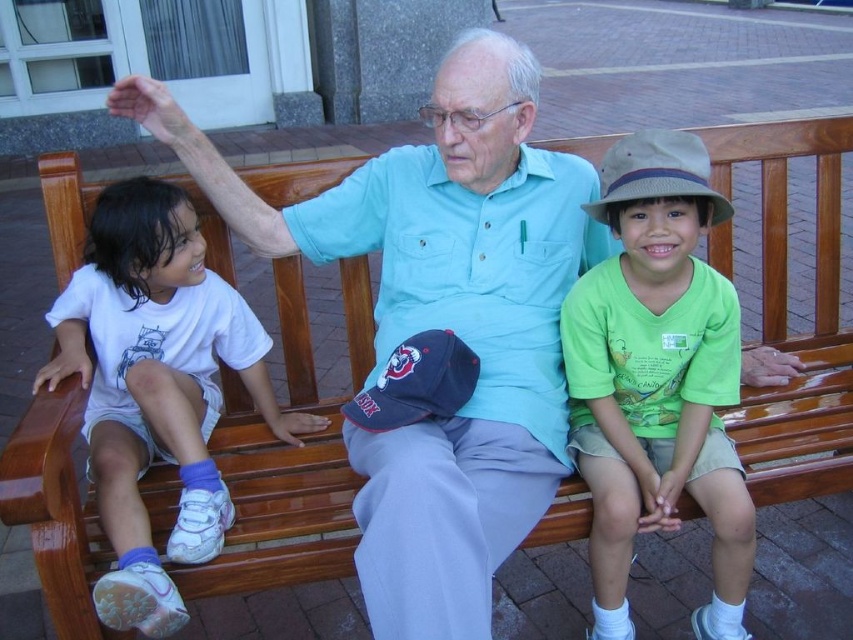
Question: Can you confirm if green cotton shirt at center is smaller than white cotton shirt at left?

Choices:
 (A) no
 (B) yes

Answer: (B)

Question: Which point is closer to the camera taking this photo?

Choices:
 (A) (695, 460)
 (B) (86, 305)

Answer: (A)

Question: Is green cotton shirt at center thinner than white cotton shirt at left?

Choices:
 (A) yes
 (B) no

Answer: (A)

Question: Which point is farther to the camera?

Choices:
 (A) white cotton shirt at left
 (B) green cotton shirt at center

Answer: (B)

Question: Is green cotton shirt at center to the left of white cotton shirt at left from the viewer's perspective?

Choices:
 (A) no
 (B) yes

Answer: (A)